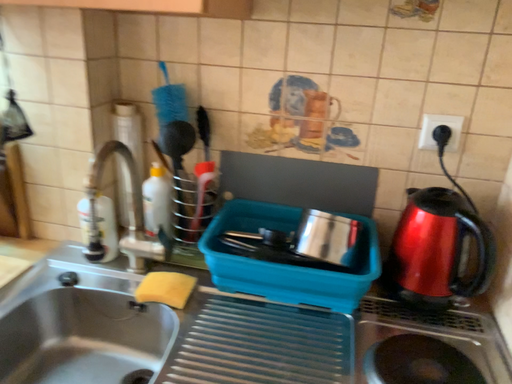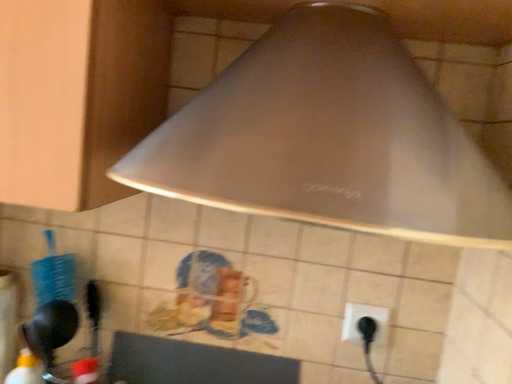
Question: Which way did the camera rotate in the video?

Choices:
 (A) rotated downward
 (B) rotated upward

Answer: (B)